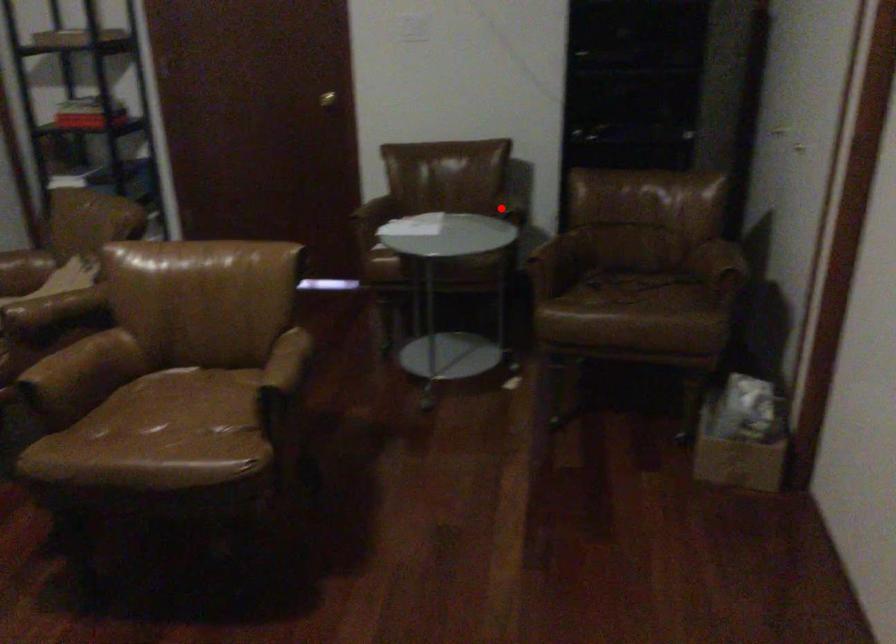
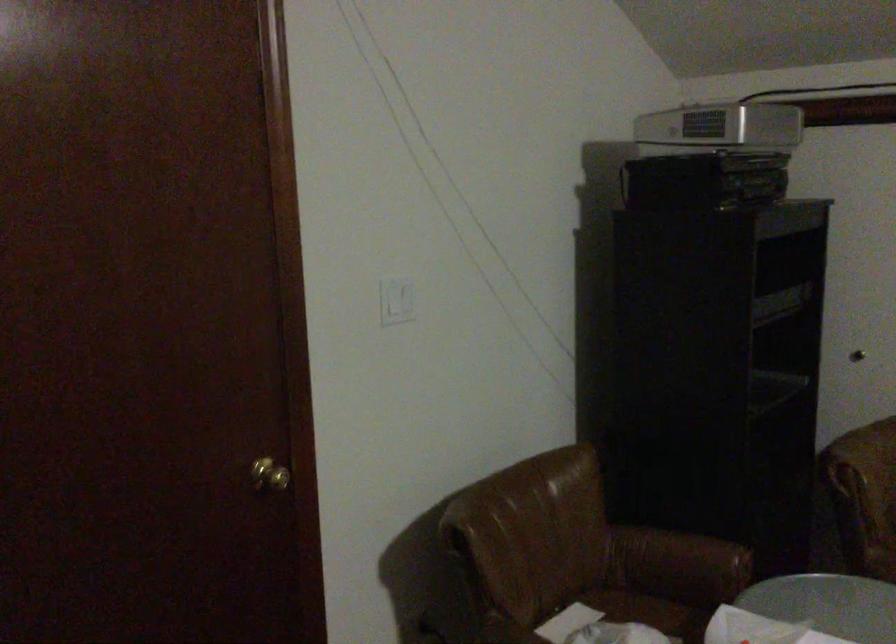
Question: I am providing you with two images of the same scene from different viewpoints. Given a red point in image1, look at the same physical point in image2. Is it:

Choices:
 (A) Closer to the viewpoint
 (B) Farther from the viewpoint

Answer: (A)